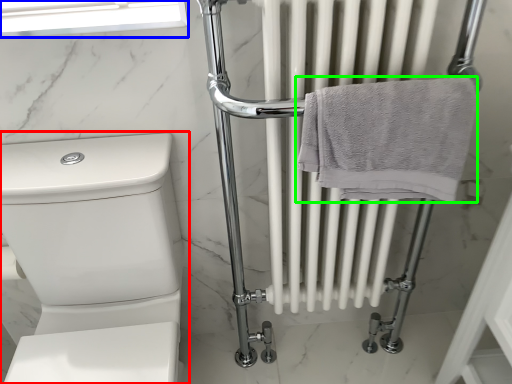
Question: Based on their relative distances, which object is farther from toilet (highlighted by a red box)? Choose from window screen (highlighted by a blue box) and towel (highlighted by a green box).

Choices:
 (A) window screen
 (B) towel

Answer: (B)